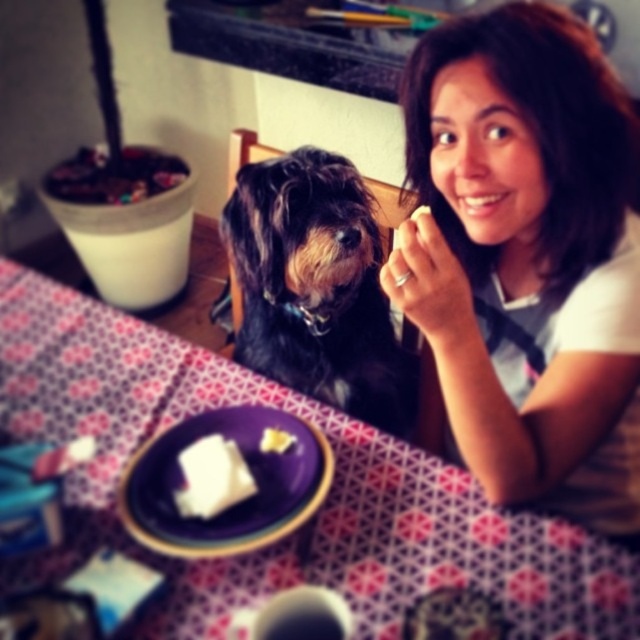
You are a chef preparing a meal and need to place both the purple matte plate at center and the white crumbly bread at center on a table. If the table has a limited space, which object should you place first to ensure both fit?

The purple matte plate at center might be wider than white crumbly bread at center, so you should place the purple matte plate at center first to ensure both fit on the table.

You are a photographer setting up a shoot in this dining area. You need to position a small prop between the white cotton shirt at upper right and the patterned fabric tablecloth at center. Where should you place it so it doesn

The white cotton shirt at upper right is taller than the patterned fabric tablecloth at center, so placing the prop between them would require positioning it closer to the lower part of the white cotton shirt at upper right and the upper part of the patterned fabric tablecloth at center to ensure it sits between their vertical positions.

You are a chef preparing a dish and need to place both the purple matte plate at center and the white soft cheese at center on a shelf. The shelf has limited height clearance. Which object should you place first to ensure it fits under the shelf?

The purple matte plate at center is taller than the white soft cheese at center, so you should place the purple matte plate at center first to ensure it fits under the shelf clearance.